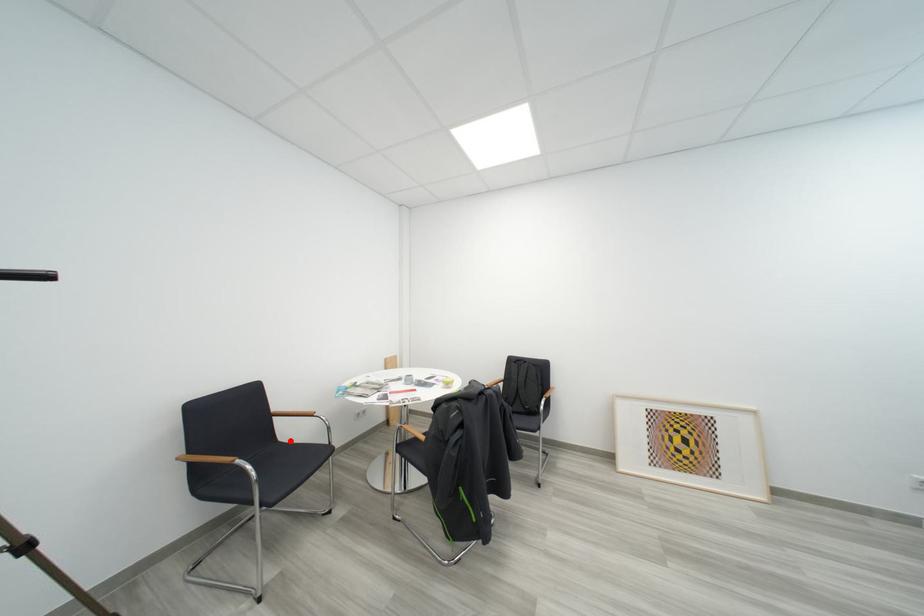
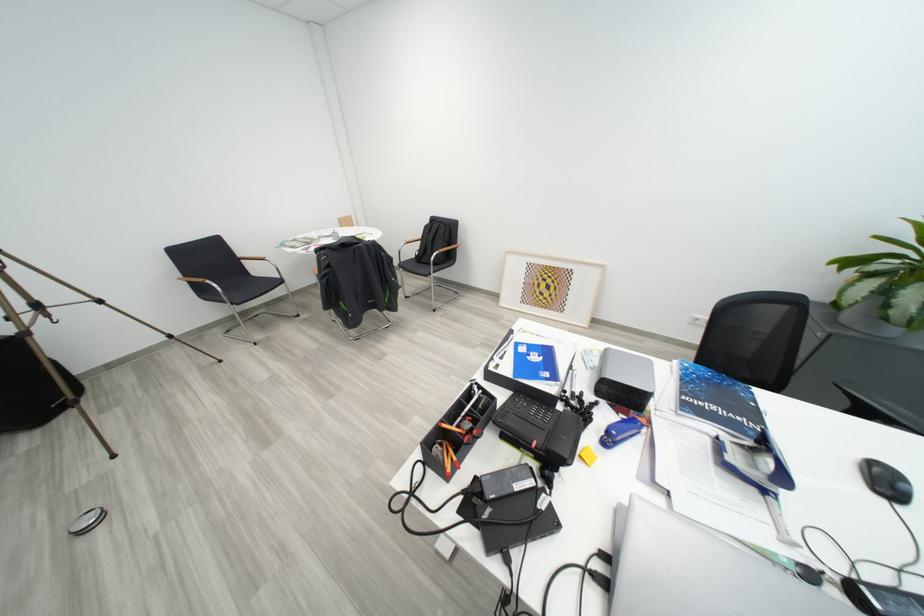
Where in the second image is the point corresponding to the highlighted location from the first image?

(262, 276)